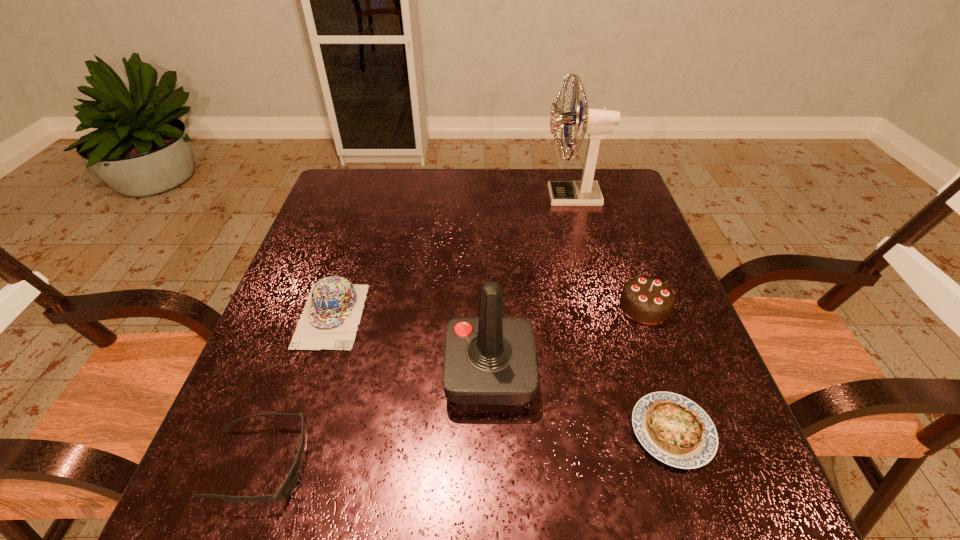
Where is `vacant space that satisfies the following two spatial constraints: 1. on the front, side, and top of the fifth shortest object; 2. on the left side of the cap`? vacant space that satisfies the following two spatial constraints: 1. on the front, side, and top of the fifth shortest object; 2. on the left side of the cap is located at coordinates (313, 373).

Locate an element on the screen. The image size is (960, 540). vacant region that satisfies the following two spatial constraints: 1. on the front-facing side of the tallest object; 2. on the left side of the shortest object is located at coordinates (636, 431).

This screenshot has height=540, width=960. I want to click on blank area in the image that satisfies the following two spatial constraints: 1. on the front-facing side of the tallest object; 2. on the right side of the shortest object, so click(x=636, y=431).

The height and width of the screenshot is (540, 960). I want to click on free space that satisfies the following two spatial constraints: 1. on the front, side, and top of the second tallest object; 2. on the right side of the cap, so click(313, 373).